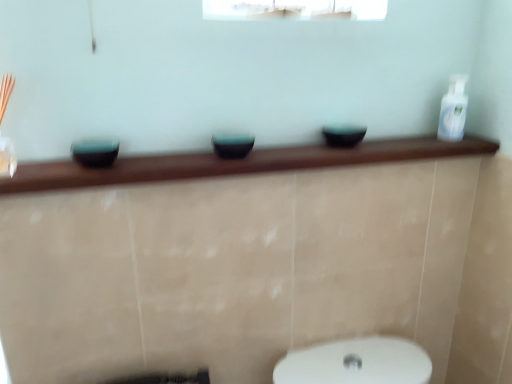
Question: From the image's perspective, is matte black bowl at center, which is the 2th basin from left to right, positioned above or below matte black bowl at center, which ranks as the 1th basin in right-to-left order?

Choices:
 (A) above
 (B) below

Answer: (B)

Question: Relative to matte black bowl at center, which ranks as the 1th basin in right-to-left order, is matte black bowl at center, the 2th basin when ordered from right to left, in front or behind?

Choices:
 (A) front
 (B) behind

Answer: (A)

Question: Based on their relative distances, which object is farther from the teal glossy bowl at left, which appears as the 1th basin when viewed from the left?

Choices:
 (A) white glossy bottle at upper right
 (B) matte black bowl at center, the 2th basin when ordered from right to left
 (C) matte black bowl at center, the 3th basin from the left

Answer: (A)

Question: Estimate the real-world distances between objects in this image. Which object is closer to the white glossy bottle at upper right?

Choices:
 (A) matte black bowl at center, the 2th basin when ordered from right to left
 (B) matte black bowl at center, the 3th basin from the left
 (C) teal glossy bowl at left, which is the 3th basin from right to left

Answer: (B)